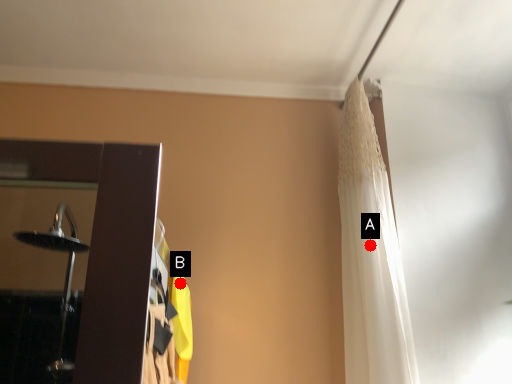
Question: Two points are circled on the image, labeled by A and B beside each circle. Which point is further to the camera?

Choices:
 (A) A is further
 (B) B is further

Answer: (B)